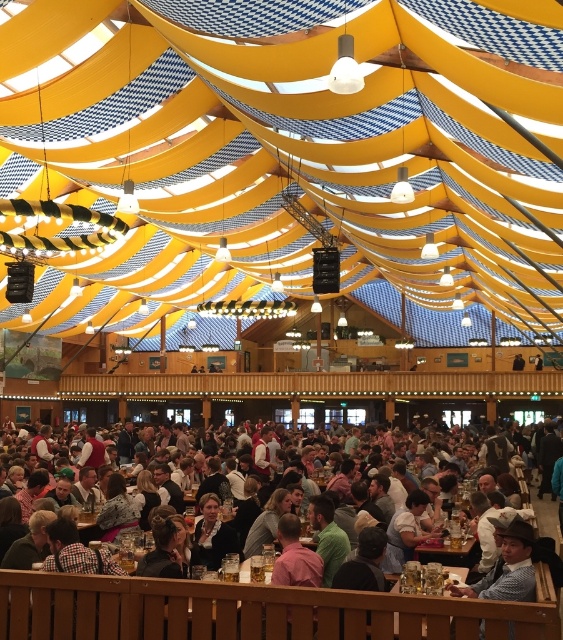
Measure the distance between point (217, 605) and camera.

The distance of point (217, 605) from camera is 11.53 meters.

Consider the image. Can you confirm if white shirt at center is bigger than wooden table at lower center?

No.

Is point (373, 589) less distant than point (390, 576)?

Yes, it is in front of point (390, 576).

At what (x,y) coordinates should I click in order to perform the action: click on white shirt at center. Please return your answer as a coordinate pair (x, y). This screenshot has width=563, height=640. Looking at the image, I should click on (252, 611).